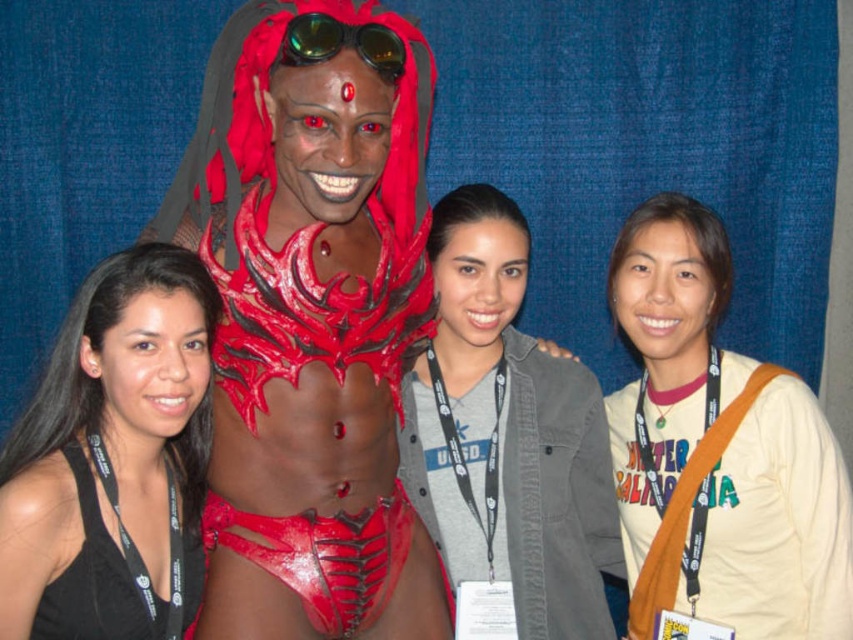
Question: In this image, where is gray cotton shirt at center located relative to green reflective plastic goggles at upper center?

Choices:
 (A) above
 (B) below

Answer: (B)

Question: Is gray cotton shirt at center wider than black matte tank top at left?

Choices:
 (A) no
 (B) yes

Answer: (B)

Question: Which of the following is the closest to the observer?

Choices:
 (A) matte red body paint at center
 (B) gray cotton shirt at center
 (C) white cotton t-shirt at center
 (D) black matte halter top at lower left

Answer: (A)

Question: Which object appears farthest from the camera in this image?

Choices:
 (A) white cotton t-shirt at center
 (B) gray cotton shirt at center
 (C) black matte tank top at left

Answer: (B)

Question: Can you confirm if white cotton t-shirt at center is positioned above gray cotton shirt at center?

Choices:
 (A) no
 (B) yes

Answer: (A)

Question: Which object is the farthest from the black matte halter top at lower left?

Choices:
 (A) green reflective plastic goggles at upper center
 (B) gray cotton shirt at center
 (C) black matte tank top at left

Answer: (A)